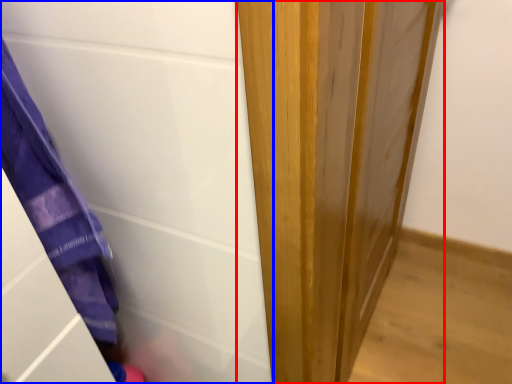
Question: Among these objects, which one is nearest to the camera, door (highlighted by a red box) or screen door (highlighted by a blue box)?

Choices:
 (A) door
 (B) screen door

Answer: (B)